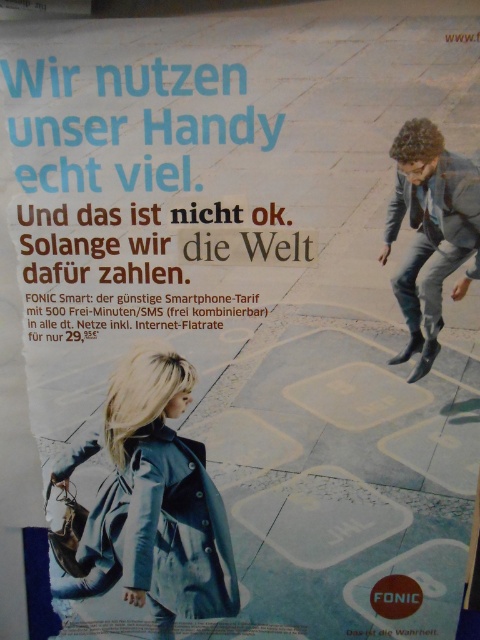
You are a fashion designer observing the FONIC Smart advertisement. You notice the matte blue coat at lower left and the gray suit at right. Which one is larger in size?

The matte blue coat at lower left is bigger than the gray suit at right.

You are a fashion designer observing the FONIC Smart advertisement. You notice the matte blue coat at lower left and the gray suit at right. Which clothing item is positioned lower in the image?

The matte blue coat at lower left is located below the gray suit at right, so it is positioned lower in the image.

You are a fashion designer observing the FONIC Smart advertisement. You notice the matte blue coat at lower left and the gray suit at right. Which clothing item is positioned closer to the front of the scene?

The matte blue coat at lower left is positioned closer to the front of the scene because the gray suit at right is behind it.